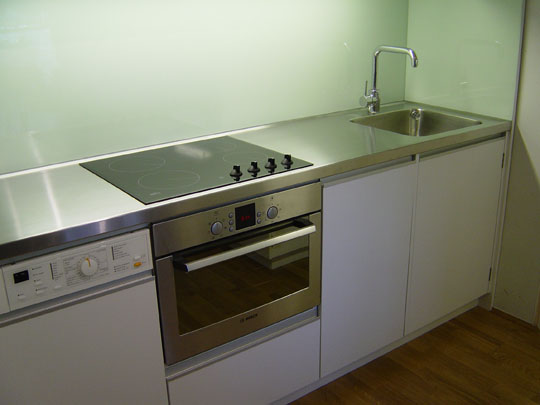
Where is `stove`? The width and height of the screenshot is (540, 405). stove is located at coordinates (190, 159).